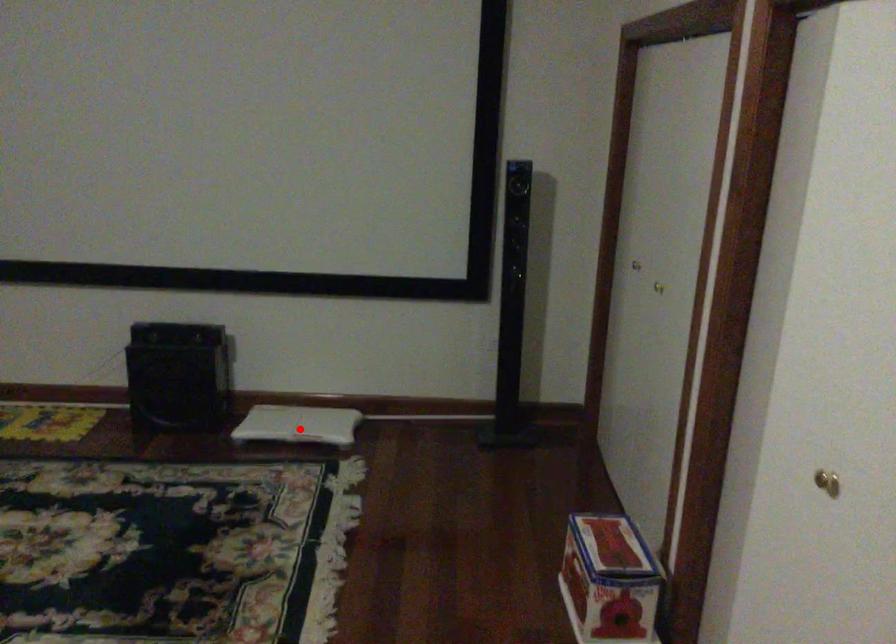
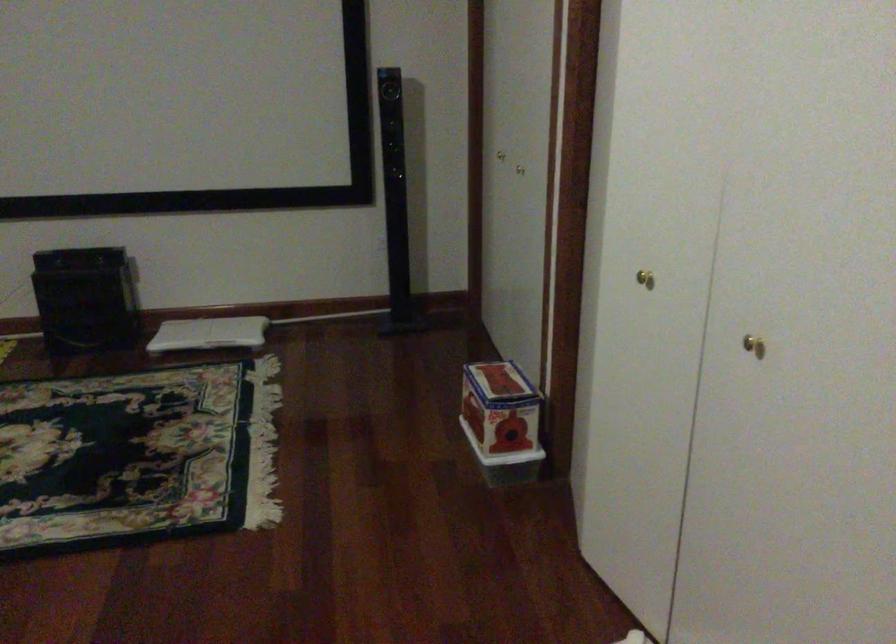
The point at the highlighted location is marked in the first image. Where is the corresponding point in the second image?

(209, 333)